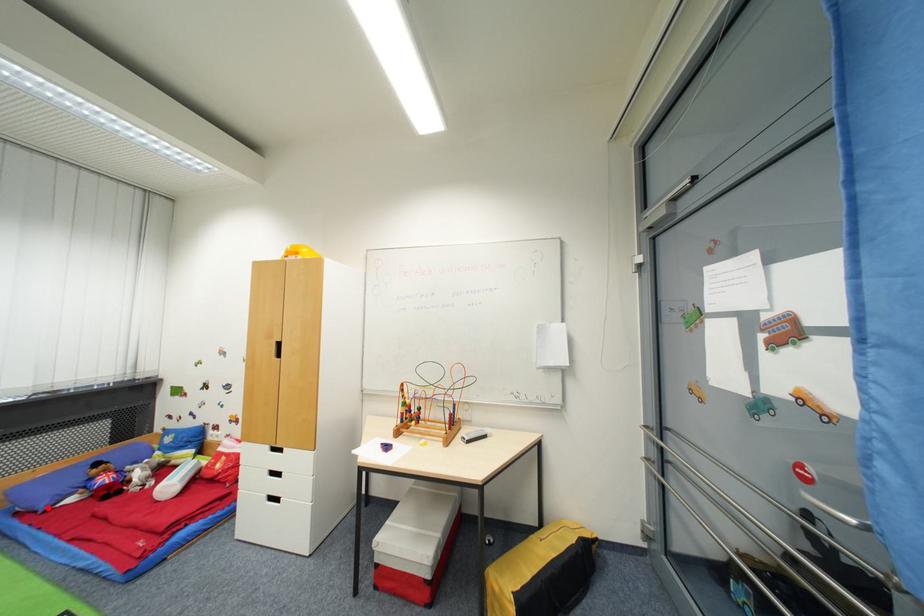
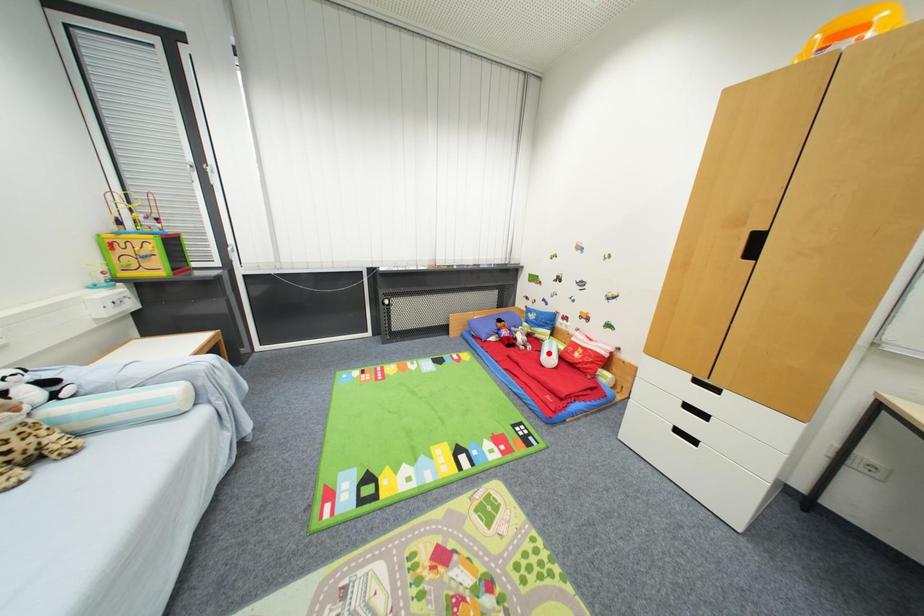
I am providing you with two images of the same scene from different viewpoints. A red point is marked on the first image and another point is marked on the second image. Do the highlighted points in image1 and image2 indicate the same real-world spot?

No